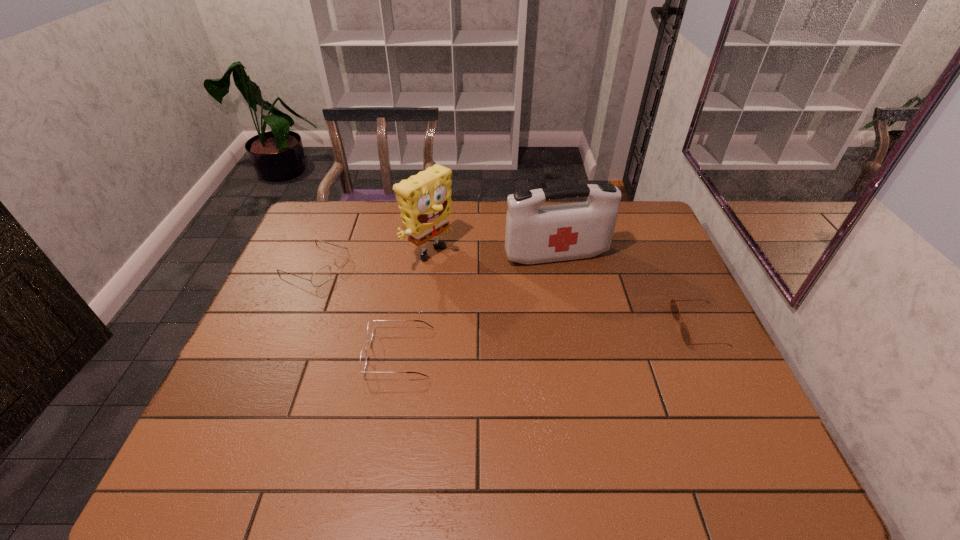
Choose which object is the third nearest neighbor to the rightmost object. Please provide its 2D coordinates. Your answer should be formatted as a tuple, i.e. [(x, y)], where the tuple contains the x and y coordinates of a point satisfying the conditions above.

[(363, 356)]

Image resolution: width=960 pixels, height=540 pixels. I want to click on object that is the closest one to the right spectacles, so click(x=322, y=275).

Identify the location of free space that satisfies the following two spatial constraints: 1. on the front side of the sunglasses; 2. on the face of the leftmost object. The image size is (960, 540). (290, 327).